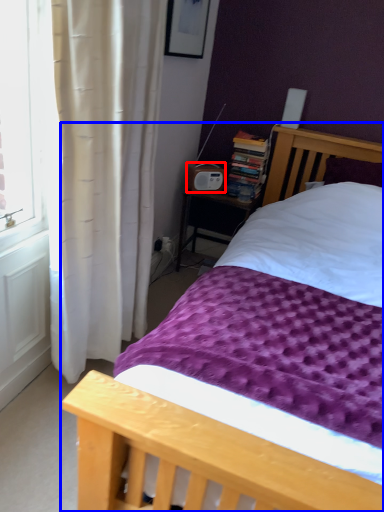
Question: Which of the following is the closest to the observer, radio (highlighted by a red box) or bed (highlighted by a blue box)?

Choices:
 (A) radio
 (B) bed

Answer: (B)